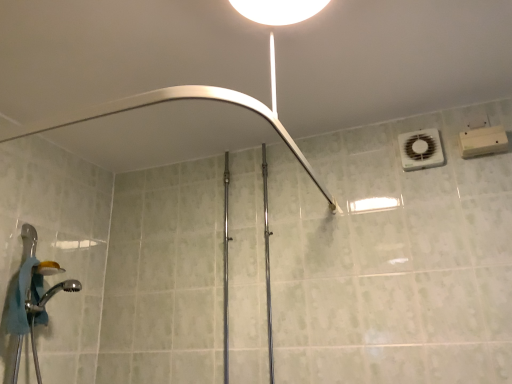
Measure the distance between point (267, 14) and camera.

The depth of point (267, 14) is 3.60 feet.

What are the coordinates of `white plastic air conditioner at upper right` in the screenshot? It's located at (421, 149).

Is brushed metal shower at upper center, the second shower when ordered from bottom to top, touching chrome metallic shower head at lower left, the first shower when ordered from bottom to top?

brushed metal shower at upper center, the second shower when ordered from bottom to top, and chrome metallic shower head at lower left, the first shower when ordered from bottom to top, are not in contact.

This screenshot has width=512, height=384. I want to click on shower on the left side of brushed metal shower at upper center, the second shower when ordered from bottom to top, so click(x=50, y=296).

Is chrome metallic shower head at lower left, which is counted as the 2th shower, starting from the top, located within brushed metal shower at upper center, the second shower when ordered from bottom to top?

No.

Considering the sizes of objects brushed metal shower at upper center, the 1th shower in the top-to-bottom sequence, and chrome metallic shower head at lower left, the first shower when ordered from bottom to top, in the image provided, who is shorter, brushed metal shower at upper center, the 1th shower in the top-to-bottom sequence, or chrome metallic shower head at lower left, the first shower when ordered from bottom to top,?

brushed metal shower at upper center, the 1th shower in the top-to-bottom sequence, is shorter.

Measure the distance between white glossy light fixture at upper center and brushed metal shower at upper center, the 1th shower in the top-to-bottom sequence.

13.02 inches.

At what (x,y) coordinates should I click in order to perform the action: click on light fixture in front of the brushed metal shower at upper center, the second shower when ordered from bottom to top. Please return your answer as a coordinate pair (x, y). The height and width of the screenshot is (384, 512). Looking at the image, I should click on (278, 10).

Considering their positions, is white glossy light fixture at upper center located in front of or behind brushed metal shower at upper center, the second shower when ordered from bottom to top?

white glossy light fixture at upper center is in front of brushed metal shower at upper center, the second shower when ordered from bottom to top.

Which is more to the left, white glossy light fixture at upper center or brushed metal shower at upper center, the second shower when ordered from bottom to top?

From the viewer's perspective, brushed metal shower at upper center, the second shower when ordered from bottom to top, appears more on the left side.

How different are the orientations of white glossy light fixture at upper center and white plastic air conditioner at upper right in degrees?

The angular difference between white glossy light fixture at upper center and white plastic air conditioner at upper right is 1.97 degrees.

Which of these two, white glossy light fixture at upper center or white plastic air conditioner at upper right, stands taller?

Standing taller between the two is white plastic air conditioner at upper right.

Can you confirm if white glossy light fixture at upper center is smaller than white plastic air conditioner at upper right?

Actually, white glossy light fixture at upper center might be larger than white plastic air conditioner at upper right.

Where is `air conditioner below the white glossy light fixture at upper center (from the image's perspective)`? The image size is (512, 384). air conditioner below the white glossy light fixture at upper center (from the image's perspective) is located at coordinates (421, 149).

Measure the distance between white plastic air conditioner at upper right and brushed metal shower at upper center, the second shower when ordered from bottom to top.

A distance of 24.71 inches exists between white plastic air conditioner at upper right and brushed metal shower at upper center, the second shower when ordered from bottom to top.

Does white plastic air conditioner at upper right touch brushed metal shower at upper center, the 1th shower in the top-to-bottom sequence?

No, white plastic air conditioner at upper right is not in contact with brushed metal shower at upper center, the 1th shower in the top-to-bottom sequence.

Is white plastic air conditioner at upper right closer to the viewer compared to brushed metal shower at upper center, the second shower when ordered from bottom to top?

No, white plastic air conditioner at upper right is further to the viewer.

Which shower is the 2nd one when counting from the front of the white plastic air conditioner at upper right? Please provide its 2D coordinates.

[(175, 100)]

Can you confirm if brushed metal shower at upper center, the 1th shower in the top-to-bottom sequence, is thinner than white plastic air conditioner at upper right?

No, brushed metal shower at upper center, the 1th shower in the top-to-bottom sequence, is not thinner than white plastic air conditioner at upper right.

Which of these two, brushed metal shower at upper center, the 1th shower in the top-to-bottom sequence, or white plastic air conditioner at upper right, stands shorter?

With less height is brushed metal shower at upper center, the 1th shower in the top-to-bottom sequence.

Which of these two, brushed metal shower at upper center, the second shower when ordered from bottom to top, or white plastic air conditioner at upper right, is bigger?

brushed metal shower at upper center, the second shower when ordered from bottom to top.

Is point (146, 103) more distant than point (429, 145)?

That is False.

Is point (40, 309) more distant than point (101, 114)?

Yes, point (40, 309) is behind point (101, 114).

Is brushed metal shower at upper center, the second shower when ordered from bottom to top, inside chrome metallic shower head at lower left, which is counted as the 2th shower, starting from the top?

No, brushed metal shower at upper center, the second shower when ordered from bottom to top, is not a part of chrome metallic shower head at lower left, which is counted as the 2th shower, starting from the top.

Would you say chrome metallic shower head at lower left, which is counted as the 2th shower, starting from the top, is a long distance from brushed metal shower at upper center, the 1th shower in the top-to-bottom sequence?

They are positioned close to each other.

Between chrome metallic shower head at lower left, the first shower when ordered from bottom to top, and brushed metal shower at upper center, the 1th shower in the top-to-bottom sequence, which one has smaller size?

With smaller size is chrome metallic shower head at lower left, the first shower when ordered from bottom to top.

Which is more to the right, white plastic air conditioner at upper right or chrome metallic shower head at lower left, which is counted as the 2th shower, starting from the top?

white plastic air conditioner at upper right is more to the right.

From the image's perspective, which one is positioned lower, white plastic air conditioner at upper right or chrome metallic shower head at lower left, which is counted as the 2th shower, starting from the top?

chrome metallic shower head at lower left, which is counted as the 2th shower, starting from the top, appears lower in the image.

How different are the orientations of white plastic air conditioner at upper right and chrome metallic shower head at lower left, the first shower when ordered from bottom to top, in degrees?

There is a 88.6-degree angle between the facing directions of white plastic air conditioner at upper right and chrome metallic shower head at lower left, the first shower when ordered from bottom to top.

Can you confirm if white plastic air conditioner at upper right is wider than chrome metallic shower head at lower left, which is counted as the 2th shower, starting from the top?

No, white plastic air conditioner at upper right is not wider than chrome metallic shower head at lower left, which is counted as the 2th shower, starting from the top.

What are the coordinates of `shower behind the brushed metal shower at upper center, the 1th shower in the top-to-bottom sequence` in the screenshot? It's located at (50, 296).

Where is `light fixture above the brushed metal shower at upper center, the second shower when ordered from bottom to top (from the image's perspective)`? light fixture above the brushed metal shower at upper center, the second shower when ordered from bottom to top (from the image's perspective) is located at coordinates (278, 10).

Estimate the real-world distances between objects in this image. Which object is further from chrome metallic shower head at lower left, which is counted as the 2th shower, starting from the top, white glossy light fixture at upper center or white plastic air conditioner at upper right?

white plastic air conditioner at upper right is positioned further to the anchor chrome metallic shower head at lower left, which is counted as the 2th shower, starting from the top.

Considering their positions, is white plastic air conditioner at upper right positioned further to brushed metal shower at upper center, the second shower when ordered from bottom to top, than white glossy light fixture at upper center?

white plastic air conditioner at upper right lies further to brushed metal shower at upper center, the second shower when ordered from bottom to top, than the other object.

Considering their positions, is chrome metallic shower head at lower left, which is counted as the 2th shower, starting from the top, positioned further to brushed metal shower at upper center, the 1th shower in the top-to-bottom sequence, than white glossy light fixture at upper center?

The object further to brushed metal shower at upper center, the 1th shower in the top-to-bottom sequence, is chrome metallic shower head at lower left, which is counted as the 2th shower, starting from the top.

Looking at the image, which one is located closer to white glossy light fixture at upper center, white plastic air conditioner at upper right or chrome metallic shower head at lower left, which is counted as the 2th shower, starting from the top?

Among the two, white plastic air conditioner at upper right is located nearer to white glossy light fixture at upper center.

Based on the photo, based on their spatial positions, is white glossy light fixture at upper center or white plastic air conditioner at upper right further from brushed metal shower at upper center, the 1th shower in the top-to-bottom sequence?

The object further to brushed metal shower at upper center, the 1th shower in the top-to-bottom sequence, is white plastic air conditioner at upper right.

When comparing their distances from brushed metal shower at upper center, the second shower when ordered from bottom to top, does white glossy light fixture at upper center or chrome metallic shower head at lower left, the first shower when ordered from bottom to top, seem further?

chrome metallic shower head at lower left, the first shower when ordered from bottom to top, is further to brushed metal shower at upper center, the second shower when ordered from bottom to top.

Estimate the real-world distances between objects in this image. Which object is closer to white plastic air conditioner at upper right, chrome metallic shower head at lower left, which is counted as the 2th shower, starting from the top, or brushed metal shower at upper center, the second shower when ordered from bottom to top?

The object closer to white plastic air conditioner at upper right is brushed metal shower at upper center, the second shower when ordered from bottom to top.

Considering their positions, is white plastic air conditioner at upper right positioned closer to chrome metallic shower head at lower left, the first shower when ordered from bottom to top, than brushed metal shower at upper center, the second shower when ordered from bottom to top?

brushed metal shower at upper center, the second shower when ordered from bottom to top, is positioned closer to the anchor chrome metallic shower head at lower left, the first shower when ordered from bottom to top.

Where is `light fixture situated between chrome metallic shower head at lower left, the first shower when ordered from bottom to top, and white plastic air conditioner at upper right from left to right`? light fixture situated between chrome metallic shower head at lower left, the first shower when ordered from bottom to top, and white plastic air conditioner at upper right from left to right is located at coordinates (278, 10).

Find the location of a particular element. Image resolution: width=512 pixels, height=384 pixels. shower between white glossy light fixture at upper center and chrome metallic shower head at lower left, which is counted as the 2th shower, starting from the top, from top to bottom is located at coordinates (175, 100).

Find the location of a particular element. The image size is (512, 384). light fixture located between brushed metal shower at upper center, the second shower when ordered from bottom to top, and white plastic air conditioner at upper right in the left-right direction is located at coordinates (278, 10).

Where is `shower located between chrome metallic shower head at lower left, which is counted as the 2th shower, starting from the top, and white plastic air conditioner at upper right in the left-right direction`? shower located between chrome metallic shower head at lower left, which is counted as the 2th shower, starting from the top, and white plastic air conditioner at upper right in the left-right direction is located at coordinates (175, 100).